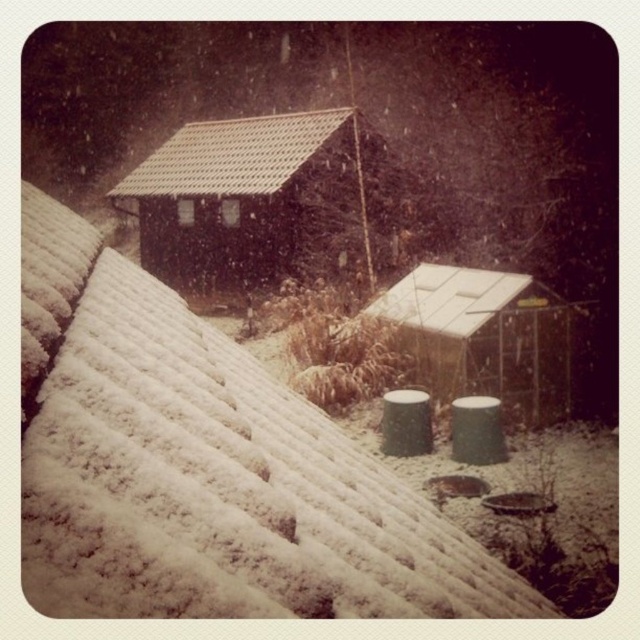
Between white plastic shed at center and brown tile roof at upper center, which one has less height?

white plastic shed at center

Can you confirm if white plastic shed at center is smaller than brown tile roof at upper center?

Indeed, white plastic shed at center has a smaller size compared to brown tile roof at upper center.

Is point (406, 321) closer to camera compared to point (189, 182)?

Yes, it is.

At what (x,y) coordinates should I click in order to perform the action: click on white plastic shed at center. Please return your answer as a coordinate pair (x, y). Looking at the image, I should click on (484, 337).

Does brown wooden hut at upper center come in front of brown tile roof at upper center?

Yes, it is in front of brown tile roof at upper center.

Can you confirm if brown wooden hut at upper center is thinner than brown tile roof at upper center?

No, brown wooden hut at upper center is not thinner than brown tile roof at upper center.

This screenshot has height=640, width=640. What do you see at coordinates (259, 198) in the screenshot?
I see `brown wooden hut at upper center` at bounding box center [259, 198].

I want to click on brown wooden hut at upper center, so click(259, 198).

Does brown wooden hut at upper center appear over white plastic shed at center?

Yes.

Does point (273, 280) come in front of point (460, 266)?

No.

The width and height of the screenshot is (640, 640). What are the coordinates of `brown wooden hut at upper center` in the screenshot? It's located at (259, 198).